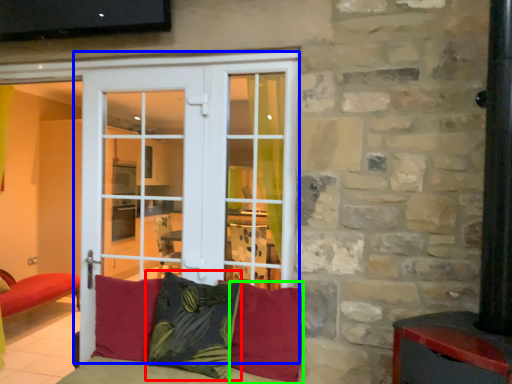
Question: Which object is the closest to the pillow (highlighted by a red box)? Choose among these: door (highlighted by a blue box) or pillow (highlighted by a green box).

Choices:
 (A) door
 (B) pillow

Answer: (B)